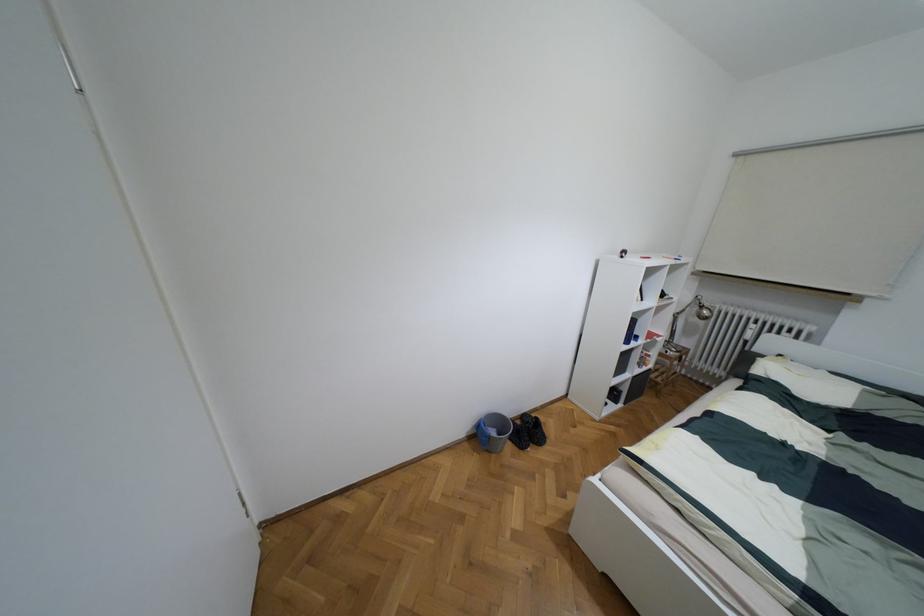
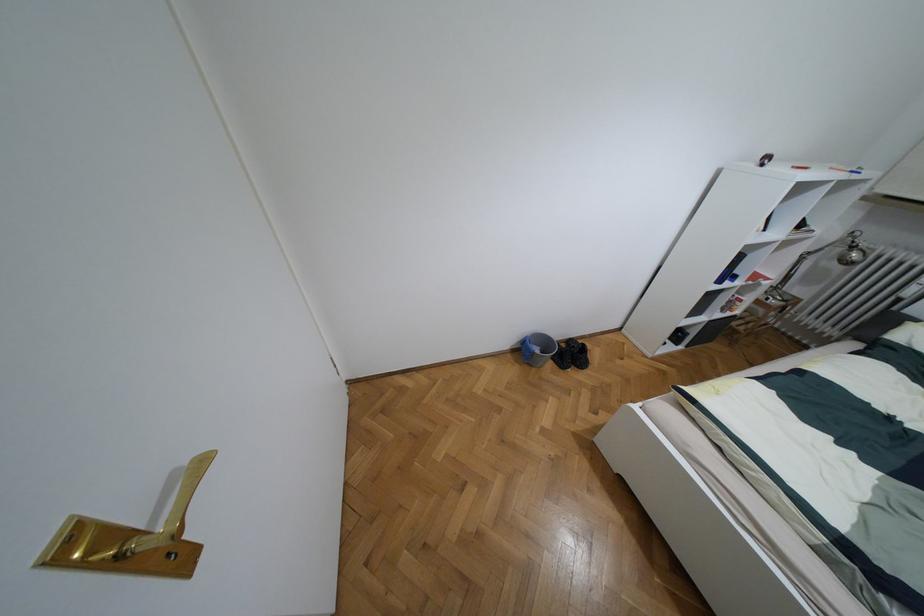
The point at [517,422] is marked in the first image. Where is the corresponding point in the second image?

(563, 345)